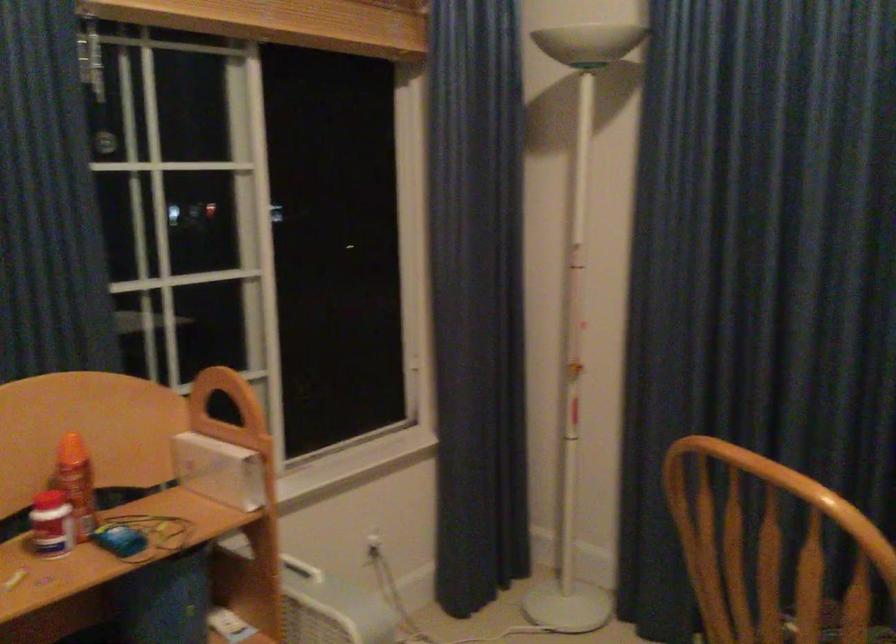
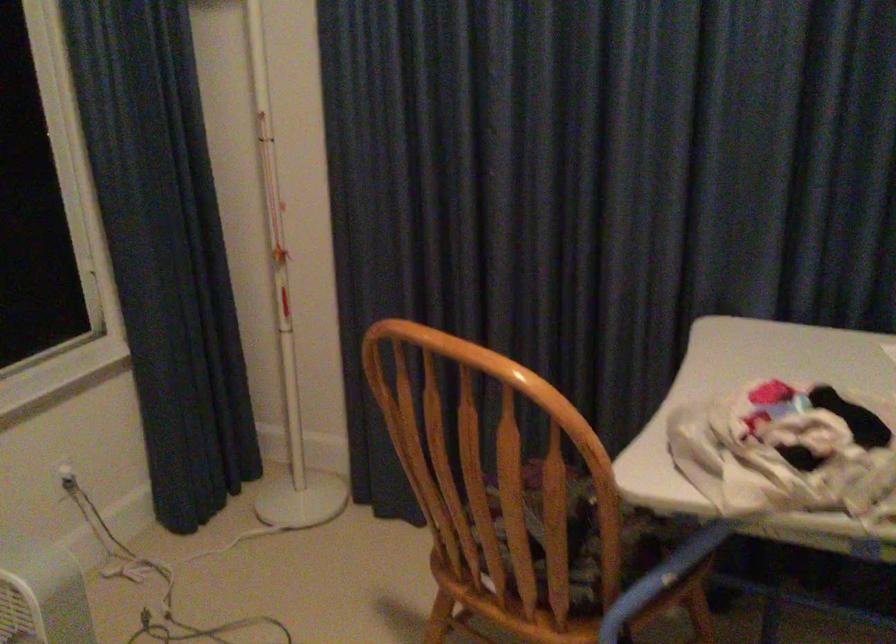
Find the pixel in the second image that matches (x=392, y=333) in the first image.

(66, 230)